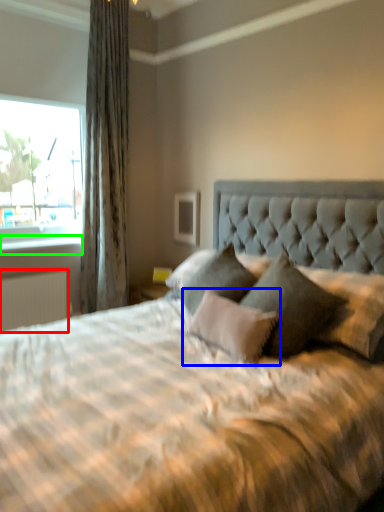
Question: Estimate the real-world distances between objects in this image. Which object is closer to radiator (highlighted by a red box), pillow (highlighted by a blue box) or window sill (highlighted by a green box)?

Choices:
 (A) pillow
 (B) window sill

Answer: (B)